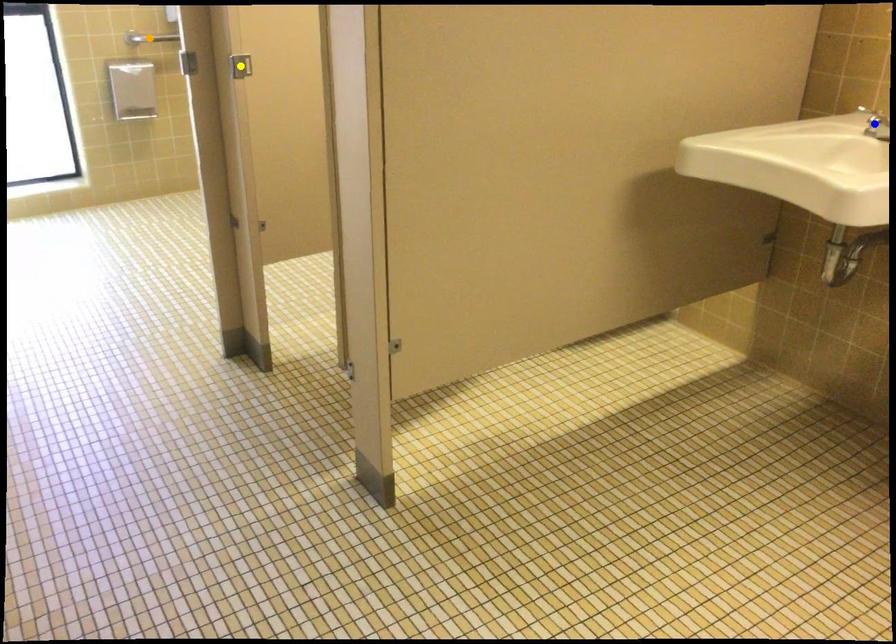
Order these from nearest to farthest:
blue point
orange point
yellow point

blue point → yellow point → orange point